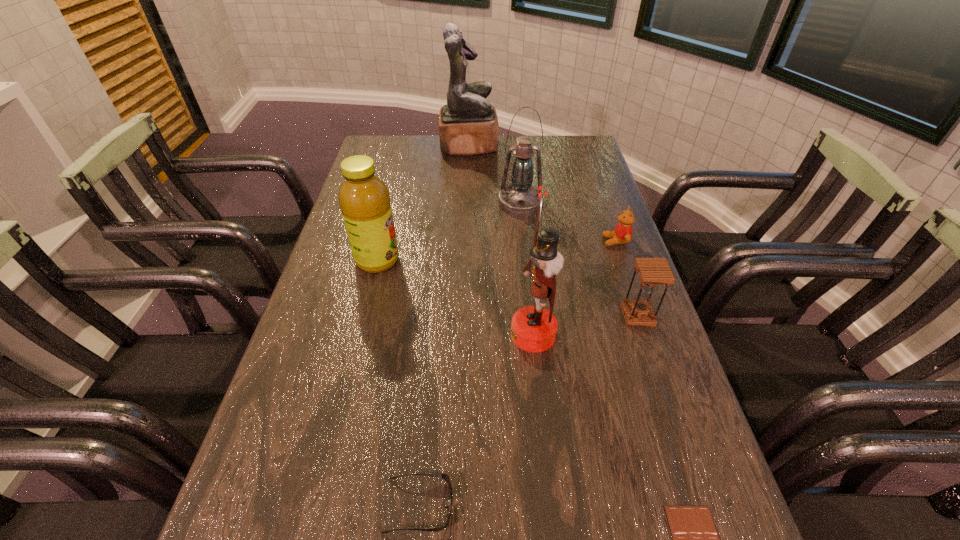
You are a GUI agent. You are given a task and a screenshot of the screen. Output one action in this format:
    pyautogui.click(x=<x>, y=<y>)
    Task: Click on the farthest object
    The width and height of the screenshot is (960, 540).
    Given the screenshot: What is the action you would take?
    pyautogui.click(x=468, y=125)

Where is `nutcracker`? Image resolution: width=960 pixels, height=540 pixels. nutcracker is located at coordinates (533, 328).

Identify the location of the seventh nearest object. (520, 198).

Locate an element on the screen. The image size is (960, 540). the leftmost object is located at coordinates (364, 199).

The height and width of the screenshot is (540, 960). Find the location of `hourglass`. hourglass is located at coordinates (652, 272).

Where is `the third shortest object`? The image size is (960, 540). the third shortest object is located at coordinates (622, 234).

Image resolution: width=960 pixels, height=540 pixels. What are the coordinates of `the second shortest object` in the screenshot? It's located at (444, 476).

Find the location of a particular element. This screenshot has height=540, width=960. free space located 0.110m in a relaxed pose on the farthest object is located at coordinates (527, 146).

Find the location of a particular element. Image resolution: width=960 pixels, height=540 pixels. vacant region located on the front-facing side of the nutcracker is located at coordinates (432, 334).

Locate an element on the screen. vacant region located on the front-facing side of the nutcracker is located at coordinates (458, 334).